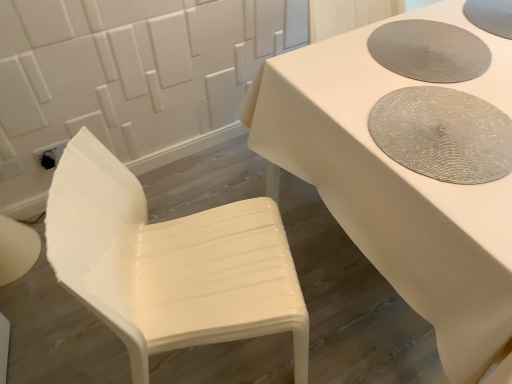
Question: Is textured gray placemat at upper right, the second manhole cover positioned from the bottom, facing away from white glossy table at center?

Choices:
 (A) no
 (B) yes

Answer: (B)

Question: Are textured gray placemat at upper right, which ranks as the second manhole cover in top-to-bottom order, and white glossy table at center making contact?

Choices:
 (A) no
 (B) yes

Answer: (A)

Question: Is textured gray placemat at upper right, the second manhole cover positioned from the bottom, not within white glossy table at center?

Choices:
 (A) yes
 (B) no

Answer: (B)

Question: Is textured gray placemat at upper right, the second manhole cover positioned from the bottom, positioned far away from white glossy table at center?

Choices:
 (A) no
 (B) yes

Answer: (A)

Question: Is textured gray placemat at upper right, the second manhole cover positioned from the bottom, thinner than white glossy table at center?

Choices:
 (A) no
 (B) yes

Answer: (B)

Question: Is white glossy chair at left in front of or behind gray woven placemat at upper right, positioned as the 3th manhole cover in bottom-to-top order, in the image?

Choices:
 (A) front
 (B) behind

Answer: (A)

Question: Is point (49, 215) positioned closer to the camera than point (504, 34)?

Choices:
 (A) closer
 (B) farther

Answer: (A)

Question: Based on their sizes in the image, would you say white glossy chair at left is bigger or smaller than gray woven placemat at upper right, positioned as the 3th manhole cover in bottom-to-top order?

Choices:
 (A) small
 (B) big

Answer: (B)

Question: Considering the positions of white glossy chair at left and gray woven placemat at upper right, marked as the first manhole cover in a top-to-bottom arrangement, in the image, is white glossy chair at left wider or thinner than gray woven placemat at upper right, marked as the first manhole cover in a top-to-bottom arrangement,?

Choices:
 (A) wide
 (B) thin

Answer: (A)

Question: From the image's perspective, is gray woven placemat at upper right, positioned as the 3th manhole cover in bottom-to-top order, above or below textured gray placemat at upper right, which ranks as the second manhole cover in top-to-bottom order?

Choices:
 (A) above
 (B) below

Answer: (A)

Question: Looking at their shapes, would you say gray woven placemat at upper right, marked as the first manhole cover in a top-to-bottom arrangement, is wider or thinner than textured gray placemat at upper right, the second manhole cover positioned from the bottom?

Choices:
 (A) thin
 (B) wide

Answer: (A)

Question: Relative to textured gray placemat at upper right, which ranks as the second manhole cover in top-to-bottom order, is gray woven placemat at upper right, marked as the first manhole cover in a top-to-bottom arrangement, in front or behind?

Choices:
 (A) behind
 (B) front

Answer: (A)

Question: In terms of height, does gray woven placemat at upper right, positioned as the 3th manhole cover in bottom-to-top order, look taller or shorter compared to textured gray placemat at upper right, the second manhole cover positioned from the bottom?

Choices:
 (A) tall
 (B) short

Answer: (B)

Question: From the image's perspective, is textured gray placemat at upper right, the second manhole cover positioned from the bottom, above or below gray woven placemat at upper right, positioned as the 3th manhole cover in bottom-to-top order?

Choices:
 (A) below
 (B) above

Answer: (A)

Question: In terms of width, does textured gray placemat at upper right, the second manhole cover positioned from the bottom, look wider or thinner when compared to gray woven placemat at upper right, positioned as the 3th manhole cover in bottom-to-top order?

Choices:
 (A) thin
 (B) wide

Answer: (B)